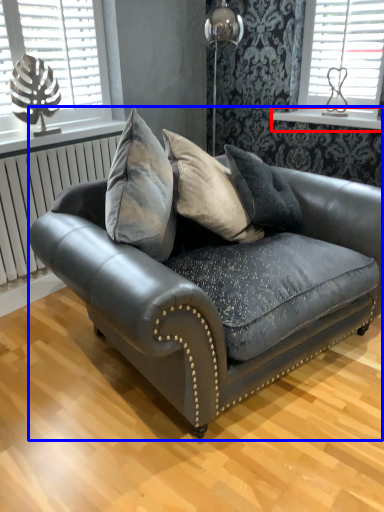
Question: Which object appears closest to the camera in this image, window sill (highlighted by a red box) or studio couch (highlighted by a blue box)?

Choices:
 (A) window sill
 (B) studio couch

Answer: (B)